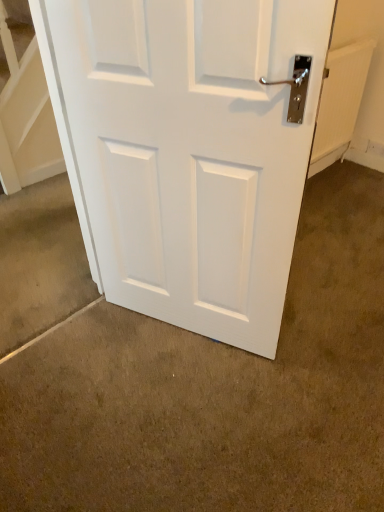
Question: From the image's perspective, is white matte door at center located above or below white matte door at center?

Choices:
 (A) above
 (B) below

Answer: (A)

Question: From their relative heights in the image, would you say white matte door at center is taller or shorter than white matte door at center?

Choices:
 (A) short
 (B) tall

Answer: (B)

Question: Does point (180, 203) appear closer or farther from the camera than point (49, 498)?

Choices:
 (A) farther
 (B) closer

Answer: (A)

Question: From the image's perspective, relative to white matte door at center, is white matte door at center above or below?

Choices:
 (A) below
 (B) above

Answer: (A)

Question: Would you say white matte door at center is inside or outside white matte door at center?

Choices:
 (A) inside
 (B) outside

Answer: (B)

Question: Considering the positions of point (84, 464) and point (117, 239), is point (84, 464) closer or farther from the camera than point (117, 239)?

Choices:
 (A) farther
 (B) closer

Answer: (B)

Question: From a real-world perspective, relative to white matte door at center, is white matte door at center vertically above or below?

Choices:
 (A) below
 (B) above

Answer: (A)